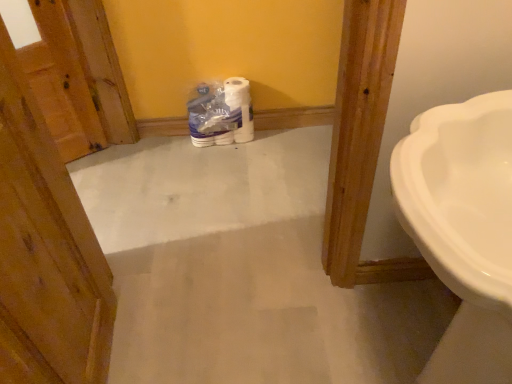
Locate an element on the screen. vacant space to the right of white glossy toilet paper at center is located at coordinates (266, 145).